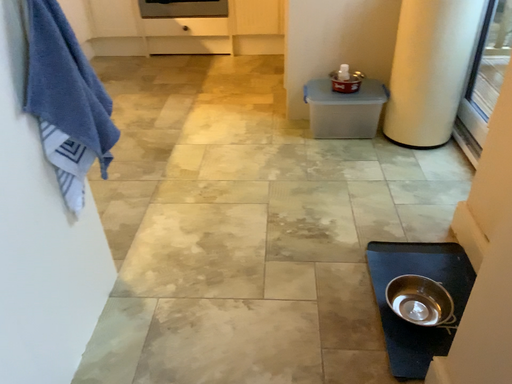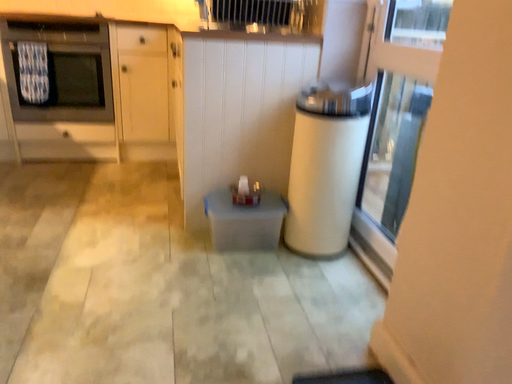
Question: How did the camera likely rotate when shooting the video?

Choices:
 (A) rotated left
 (B) rotated right

Answer: (B)